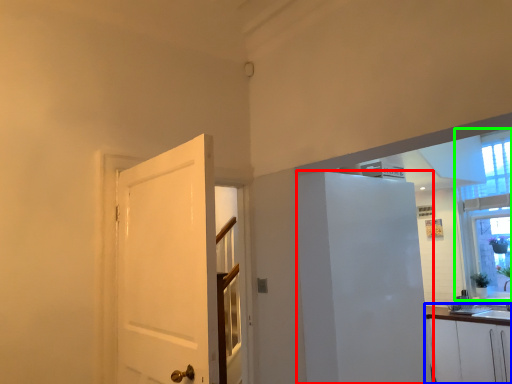
Question: Estimate the real-world distances between objects in this image. Which object is farther from elevator (highlighted by a red box), cabinetry (highlighted by a blue box) or window (highlighted by a green box)?

Choices:
 (A) cabinetry
 (B) window

Answer: (B)